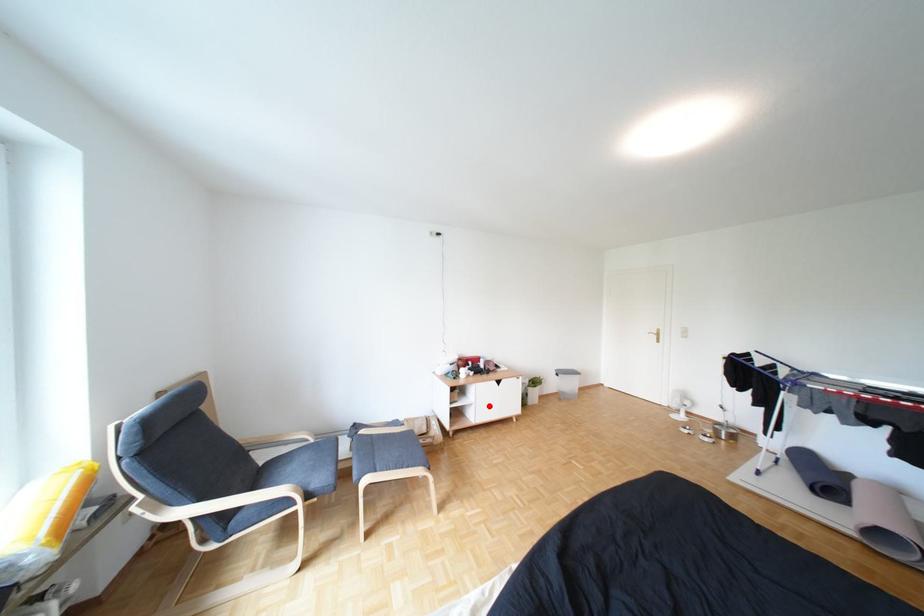
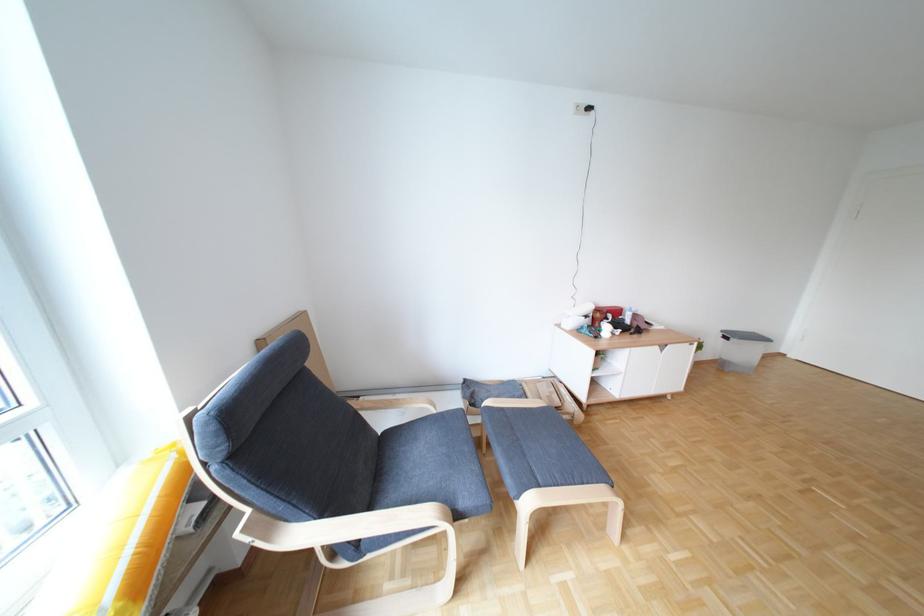
Locate, in the second image, the point that corresponds to the highlighted location in the first image.

(638, 377)